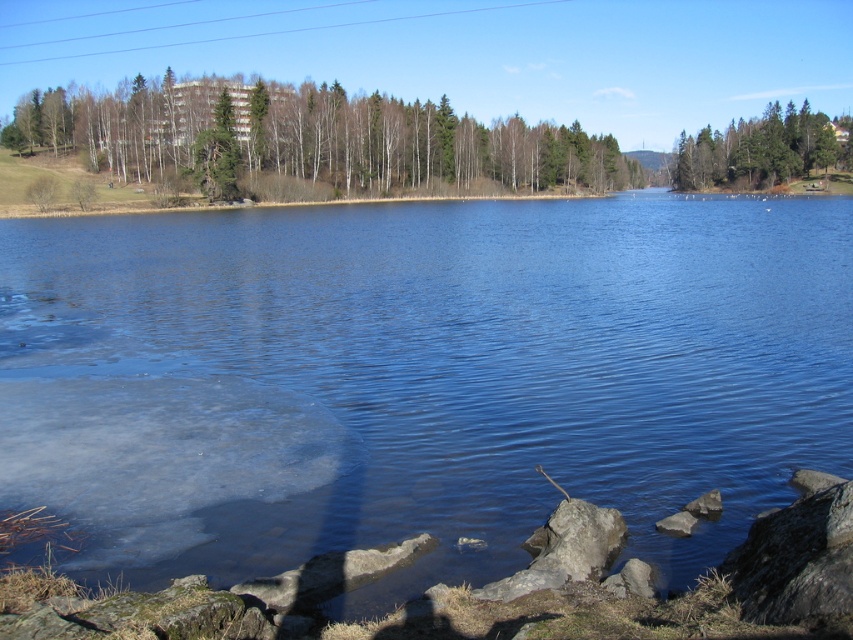
You are standing at the lakeside and want to reach the gray rock at lower right. There are green leafy trees at upper left blocking your path. Can you walk around them to get to the rock?

The gray rock at lower right is behind green leafy trees at upper left, so you can walk around the green leafy trees at upper left to reach the gray rock at lower right.

You are standing at the lakeside and want to take a photo of the green textured trees at upper right. Given that your camera has a maximum zoom range of 100 meters, will you be able to capture the trees clearly without moving closer?

The green textured trees at upper right is 142.61 meters away from the viewer. Since the camera can only zoom up to 100 meters, you won cannot capture them clearly without moving closer.

You are standing at the edge of the lake and want to place a 20 meter long floating dock. The dock must start at the blue water at center and extend towards the smooth gray rock at lower right. Will the dock reach the rock?

The distance between the blue water at center and the smooth gray rock at lower right is 21.20 meters. Since the dock is only 20 meters long, it will not reach the rock.